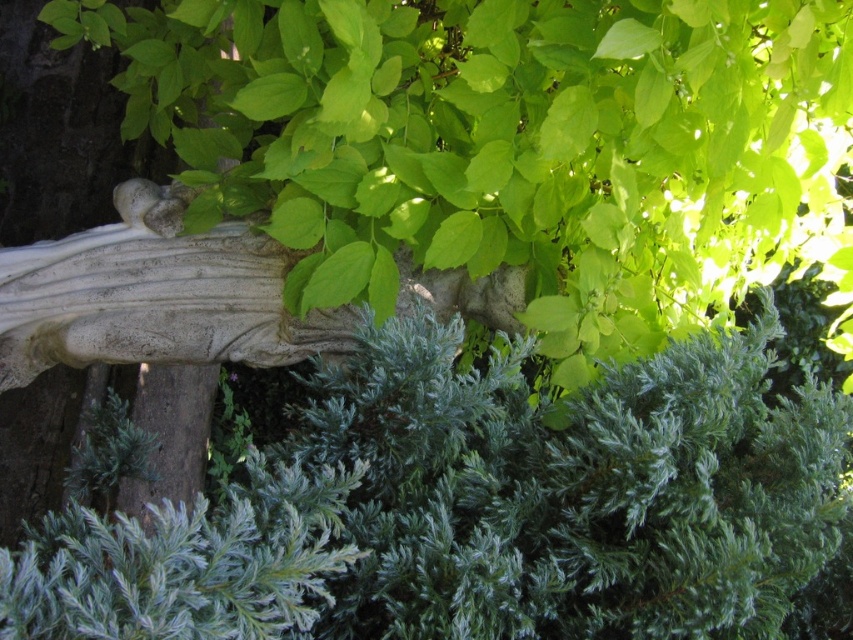
Question: Is green textured bush at center closer to the viewer compared to white stone sculpture at center?

Choices:
 (A) yes
 (B) no

Answer: (A)

Question: Does green textured bush at center have a smaller size compared to white stone sculpture at center?

Choices:
 (A) no
 (B) yes

Answer: (A)

Question: Which point appears closest to the camera in this image?

Choices:
 (A) (6, 292)
 (B) (535, 440)

Answer: (B)

Question: Which point is farther to the camera?

Choices:
 (A) (265, 252)
 (B) (286, 605)

Answer: (A)

Question: Does green textured bush at center appear over white stone sculpture at center?

Choices:
 (A) yes
 (B) no

Answer: (B)